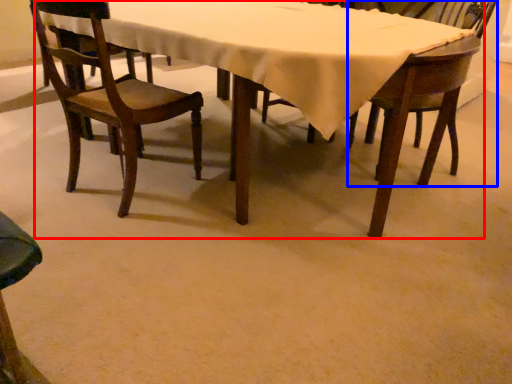
Question: Which point is further to the camera, kitchen & dining room table (highlighted by a red box) or chair (highlighted by a blue box)?

Choices:
 (A) kitchen & dining room table
 (B) chair

Answer: (B)